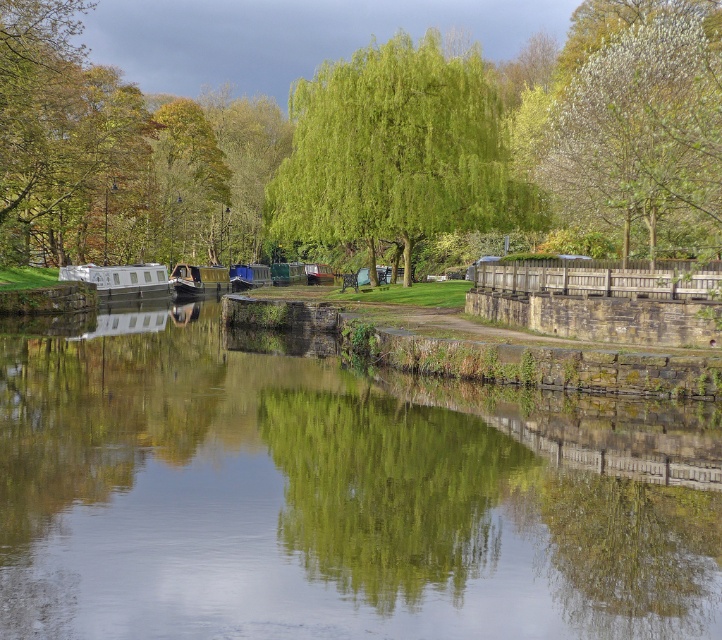
Question: Can you confirm if white fluffy tree at upper right is bigger than wooden boat at center?

Choices:
 (A) yes
 (B) no

Answer: (A)

Question: Is green stone river at center above wooden boat at center?

Choices:
 (A) yes
 (B) no

Answer: (B)

Question: Which point appears farthest from the camera in this image?

Choices:
 (A) (212, 552)
 (B) (342, 241)
 (C) (105, 266)
 (D) (664, 227)

Answer: (C)

Question: Considering the relative positions of green stone river at center and white fluffy tree at upper right in the image provided, where is green stone river at center located with respect to white fluffy tree at upper right?

Choices:
 (A) left
 (B) right

Answer: (A)

Question: Among these points, which one is nearest to the camera?

Choices:
 (A) (596, 80)
 (B) (86, 273)
 (C) (173, 291)
 (D) (349, 451)

Answer: (D)

Question: Estimate the real-world distances between objects in this image. Which object is closer to the white fluffy tree at upper right?

Choices:
 (A) green leafy tree at center
 (B) green stone river at center
 (C) wooden boat at center

Answer: (A)